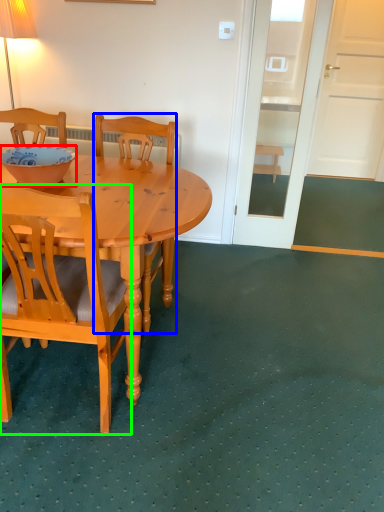
Question: Which object is the closest to the bowl (highlighted by a red box)? Choose among these: chair (highlighted by a blue box) or chair (highlighted by a green box).

Choices:
 (A) chair
 (B) chair

Answer: (A)